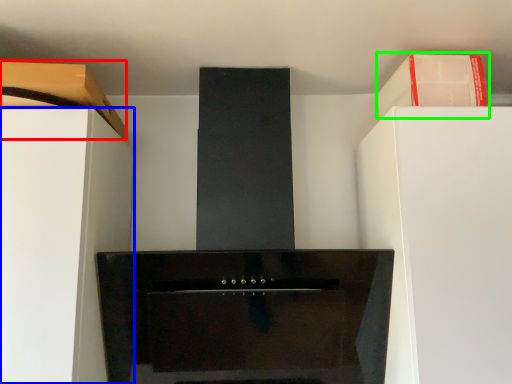
Question: Which object is positioned farthest from cabinetry (highlighted by a red box)? Select from furniture (highlighted by a blue box) and cabinetry (highlighted by a green box).

Choices:
 (A) furniture
 (B) cabinetry

Answer: (B)